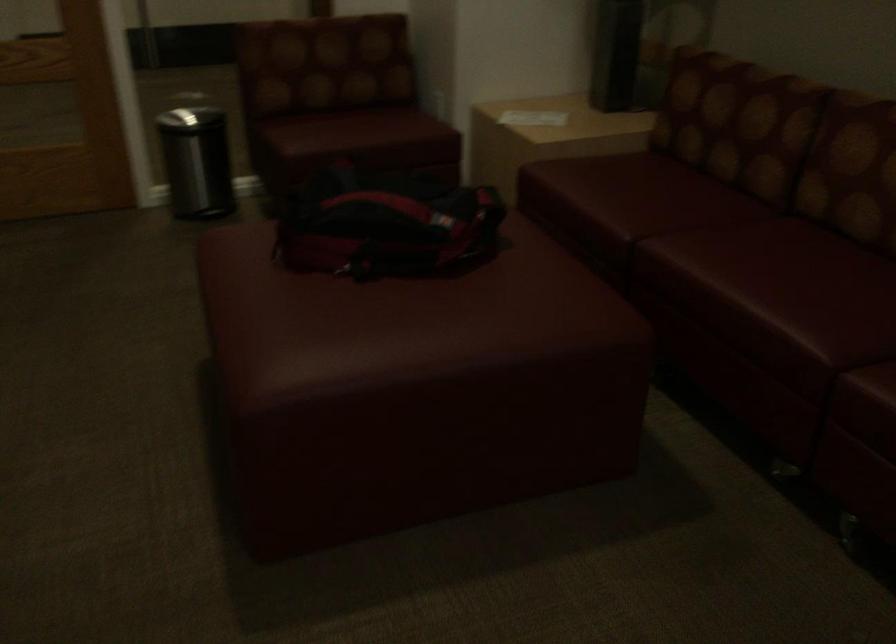
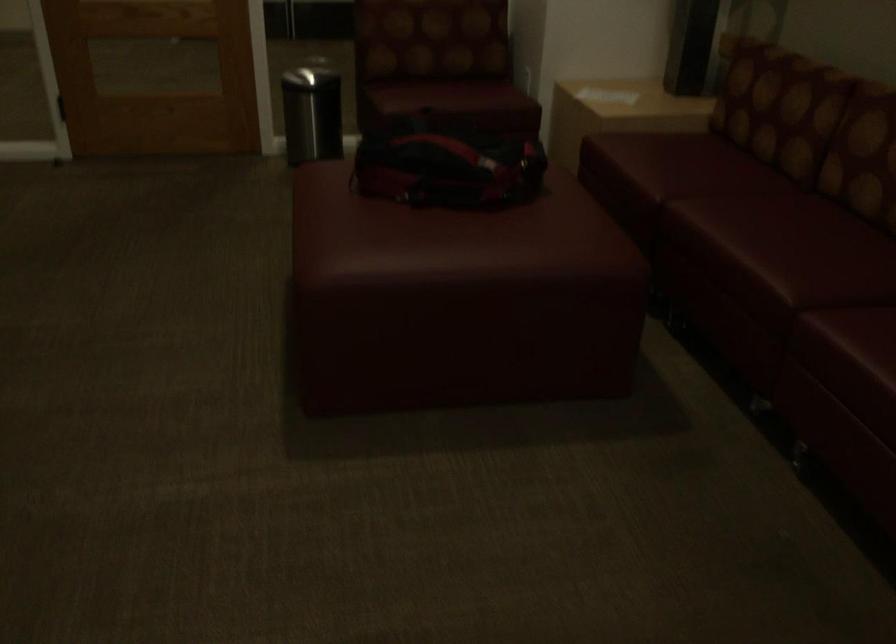
Locate, in the second image, the point that corresponds to pixel 504 348 in the first image.

(517, 267)